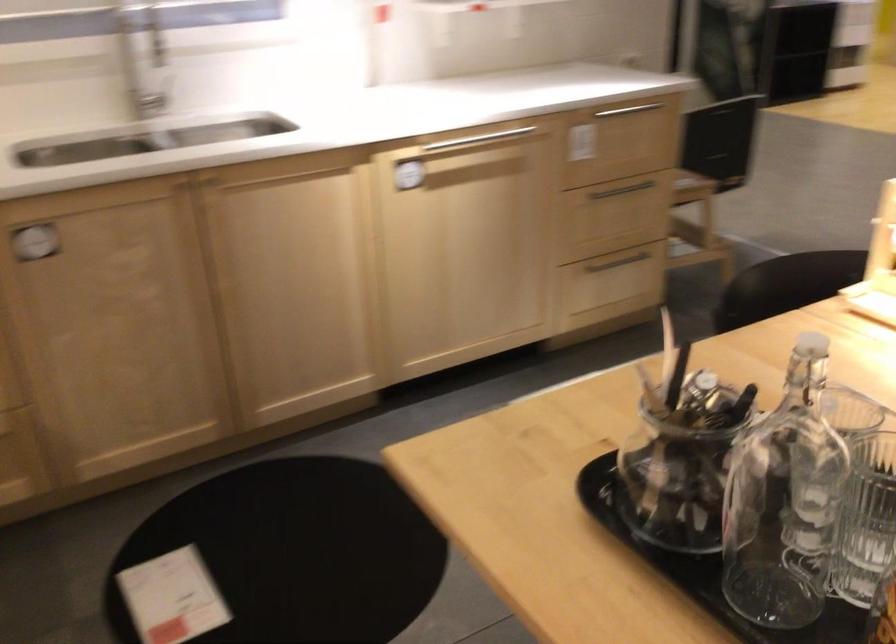
Where would you pull the silver cabinet handle? Please return your answer as a coordinate pair (x, y).

(472, 140)